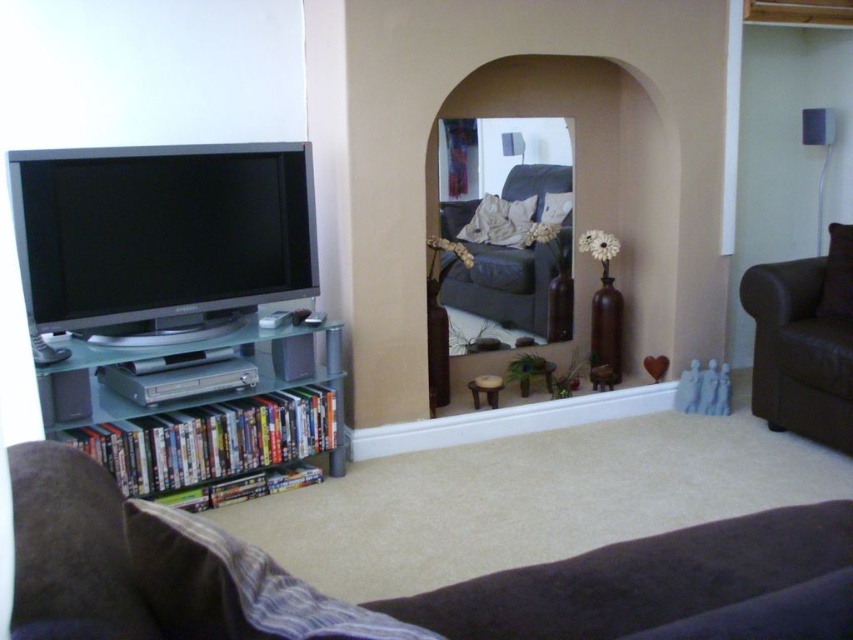
You are organizing a living room and want to place a large decorative item. Which object between the clear glass entertainment center at left and the clear plastic bookshelf at left can accommodate a larger item?

The clear glass entertainment center at left is bigger than the clear plastic bookshelf at left, so it can accommodate a larger item.

You are arranging a new lamp in the living room. You want to place it on the clear glass entertainment center at left so that it is visible from the main seating area. Will the clear plastic bookshelf at left block the view of the lamp from the seating area?

The clear glass entertainment center at left is in front of the clear plastic bookshelf at left, so placing the lamp on the entertainment center will keep it visible from the seating area without obstruction from the bookshelf.